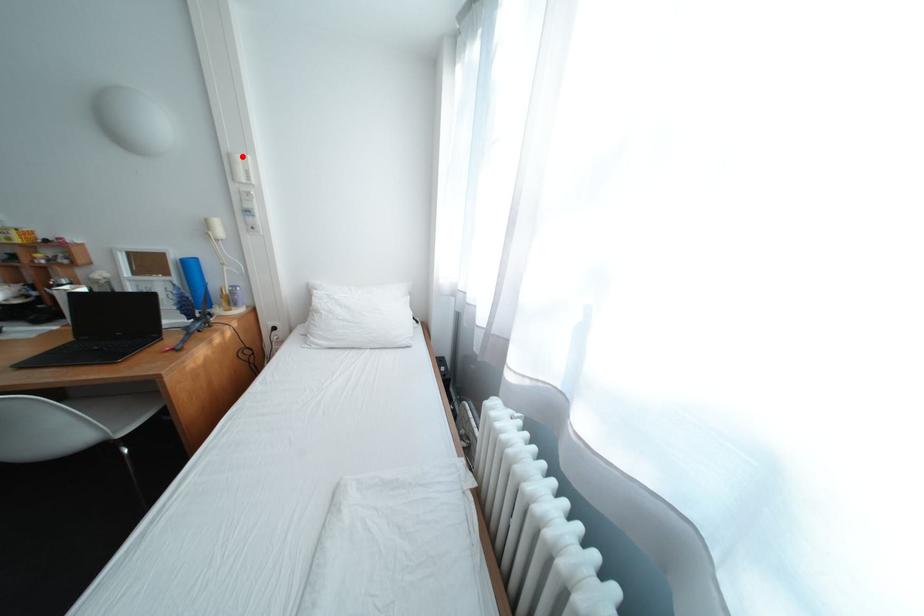
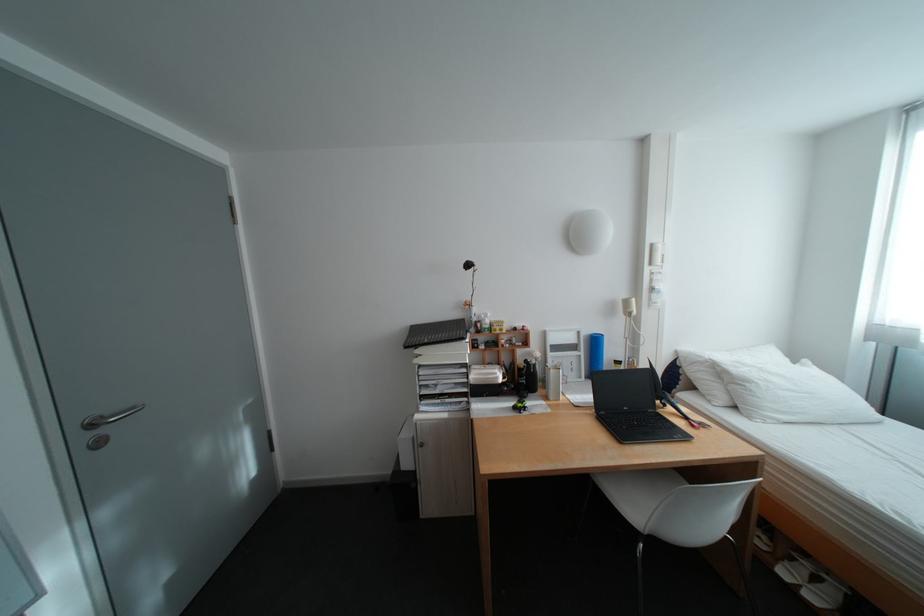
Locate, in the second image, the point that corresponds to the highlighted location in the first image.

(664, 246)